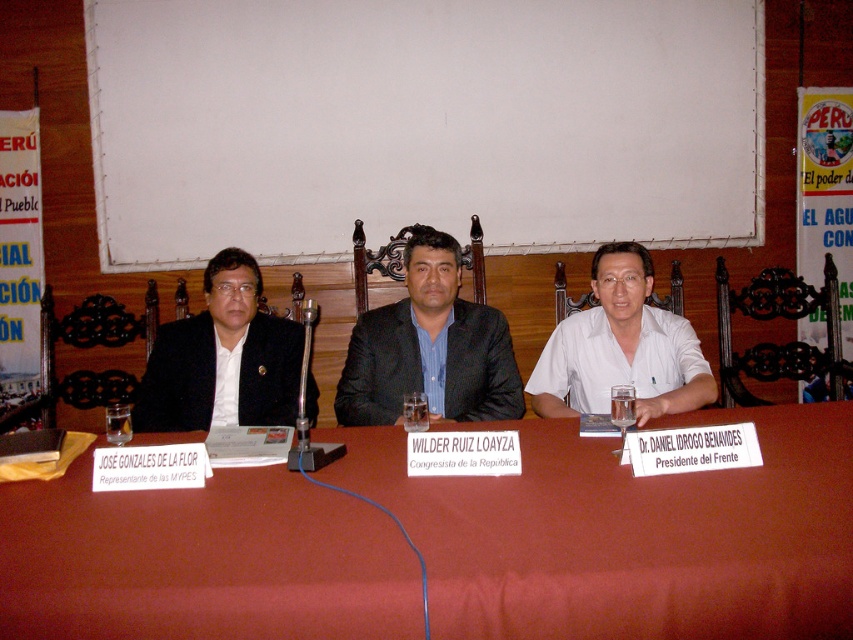
Is white paper at upper center to the right of white cotton shirt at center from the viewer's perspective?

In fact, white paper at upper center is to the left of white cotton shirt at center.

Can you confirm if white paper at upper center is shorter than white cotton shirt at center?

Incorrect, white paper at upper center's height does not fall short of white cotton shirt at center's.

At what (x,y) coordinates should I click in order to perform the action: click on white paper at upper center. Please return your answer as a coordinate pair (x, y). The image size is (853, 640). Looking at the image, I should click on (421, 124).

The height and width of the screenshot is (640, 853). What do you see at coordinates (421, 124) in the screenshot? I see `white paper at upper center` at bounding box center [421, 124].

I want to click on white paper at upper center, so click(x=421, y=124).

Who is shorter, white paper at upper center or smooth red table at center?

smooth red table at center is shorter.

Is point (482, 124) less distant than point (283, 595)?

No.

The height and width of the screenshot is (640, 853). In order to click on white paper at upper center in this screenshot , I will do `click(421, 124)`.